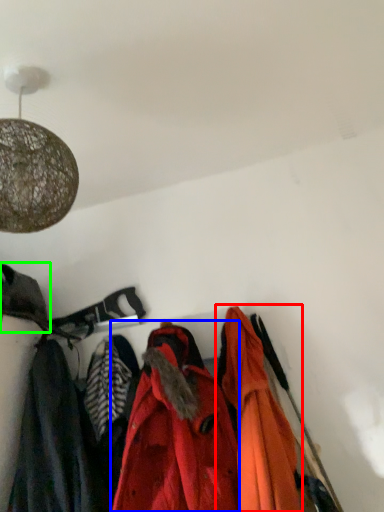
Question: Which object is the closest to the jacket (highlighted by a red box)? Choose among these: jacket (highlighted by a blue box) or cloak (highlighted by a green box).

Choices:
 (A) jacket
 (B) cloak

Answer: (A)